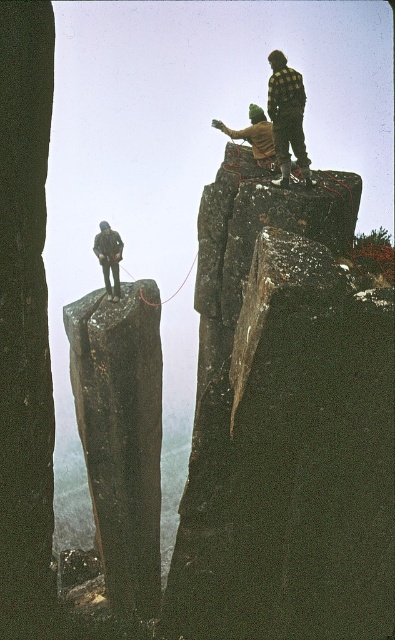
You are a hiker trying to cross a gap between two cliffs using a rope. You see a checkered flannel shirt at upper right and a camouflage jacket at left. Which piece of clothing should you aim for first to reach the other side safely?

The checkered flannel shirt at upper right is closer to the viewer than the camouflage jacket at left, so you should aim for the checkered flannel shirt at upper right first to reach the other side safely.

You are a hiker planning to cross the gap between the two cliffs using the rope. You see two items on the cliffsides, the checkered flannel shirt at upper right and the camouflage jacket at left. Which item would you use as a reference to determine the midpoint of the rope?

The checkered flannel shirt at upper right is larger in size compared to the camouflage jacket at left, so it would be easier to see from a distance and thus a better reference point for determining the midpoint of the rope.

You are a hiker planning to cross the gap between the two cliffs using the rope. You see the checkered flannel shirt at upper right and the camouflage jacket at left. Which piece of clothing should you look up to see?

The checkered flannel shirt at upper right is above the camouflage jacket at left, so you should look up to see the checkered flannel shirt at upper right.